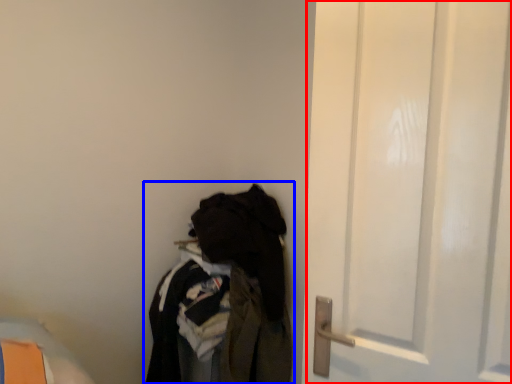
Question: Which object appears closest to the camera in this image, door (highlighted by a red box) or closet (highlighted by a blue box)?

Choices:
 (A) door
 (B) closet

Answer: (A)